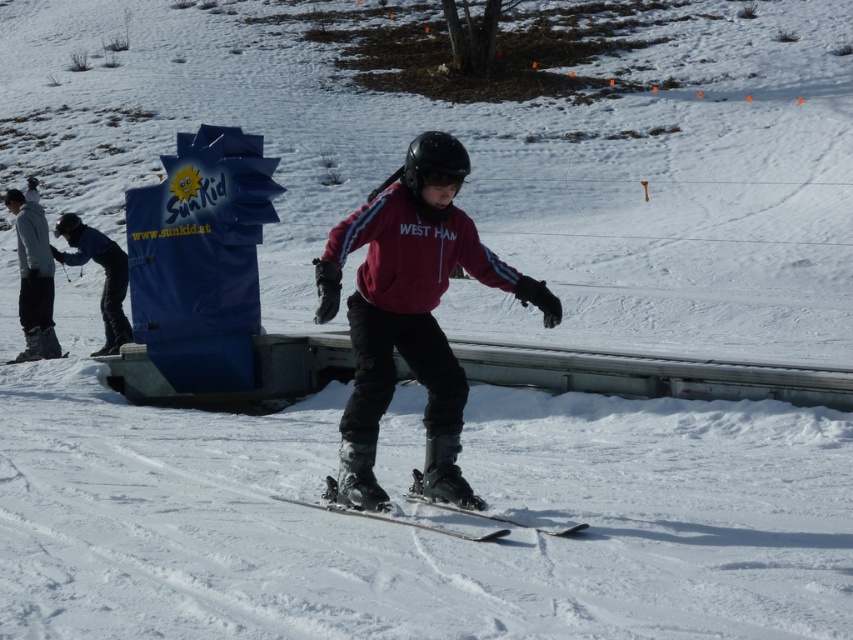
Can you confirm if gray fleece jacket at left is wider than blue fabric sign at left?

Incorrect, gray fleece jacket at left's width does not surpass blue fabric sign at left's.

Is gray fleece jacket at left above blue fabric sign at left?

Incorrect, gray fleece jacket at left is not positioned above blue fabric sign at left.

The height and width of the screenshot is (640, 853). In order to click on gray fleece jacket at left in this screenshot , I will do `click(33, 278)`.

Can you confirm if matte red jacket at center is bigger than black matte ski at center?

Indeed, matte red jacket at center has a larger size compared to black matte ski at center.

Does matte red jacket at center appear over black matte ski at center?

Correct, matte red jacket at center is located above black matte ski at center.

Is point (444, 204) less distant than point (370, 513)?

Yes.

The height and width of the screenshot is (640, 853). What are the coordinates of `matte red jacket at center` in the screenshot? It's located at (410, 314).

Which is in front, point (35, 256) or point (442, 508)?

Positioned in front is point (442, 508).

Where is `gray fleece jacket at left`? This screenshot has height=640, width=853. gray fleece jacket at left is located at coordinates (33, 278).

What do you see at coordinates (33, 278) in the screenshot?
I see `gray fleece jacket at left` at bounding box center [33, 278].

This screenshot has height=640, width=853. I want to click on gray fleece jacket at left, so click(x=33, y=278).